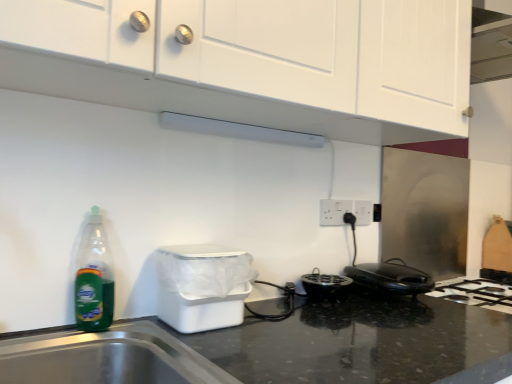
What is the approximate height of white plastic trash bin at lower left?

white plastic trash bin at lower left is 7.24 inches tall.

Where is `green translucent bottle at left`? The height and width of the screenshot is (384, 512). green translucent bottle at left is located at coordinates (94, 278).

Image resolution: width=512 pixels, height=384 pixels. In order to click on white plastic electric outlet at center right, the second electric outlet positioned from the back in this screenshot , I will do `click(334, 211)`.

Image resolution: width=512 pixels, height=384 pixels. What do you see at coordinates (238, 130) in the screenshot?
I see `white matte exhaust hood at upper center` at bounding box center [238, 130].

Image resolution: width=512 pixels, height=384 pixels. I want to click on black plastic toaster at lower right, so click(390, 278).

Identify the location of white plastic trash bin at lower left. Image resolution: width=512 pixels, height=384 pixels. (202, 286).

Can you confirm if white plastic trash bin at lower left is shorter than white plastic electric outlet at center right, the second electric outlet positioned from the back?

In fact, white plastic trash bin at lower left may be taller than white plastic electric outlet at center right, the second electric outlet positioned from the back.

Considering the relative sizes of white plastic trash bin at lower left and white plastic electric outlet at center right, which is counted as the first electric outlet, starting from the front, in the image provided, is white plastic trash bin at lower left thinner than white plastic electric outlet at center right, which is counted as the first electric outlet, starting from the front,?

No, white plastic trash bin at lower left is not thinner than white plastic electric outlet at center right, which is counted as the first electric outlet, starting from the front.

Does point (168, 300) lie behind point (330, 225)?

No, (168, 300) is in front of (330, 225).

Is the position of white plastic trash bin at lower left more distant than that of white plastic electric outlet at center right, arranged as the 1th electric outlet when viewed from the left?

That is False.

Does point (257, 129) come closer to viewer compared to point (194, 257)?

No, it is behind (194, 257).

Considering the sizes of objects white matte exhaust hood at upper center and white plastic trash bin at lower left in the image provided, who is wider, white matte exhaust hood at upper center or white plastic trash bin at lower left?

With larger width is white plastic trash bin at lower left.

Is white matte exhaust hood at upper center aimed at white plastic trash bin at lower left?

No, white matte exhaust hood at upper center is not aimed at white plastic trash bin at lower left.

The image size is (512, 384). I want to click on electric outlet beneath the white plastic electric outlet at center, which is counted as the 2th electric outlet, starting from the left (from a real-world perspective), so click(334, 211).

Between white plastic electric outlet at center, which is the first electric outlet in back-to-front order, and white plastic electric outlet at center right, which is counted as the first electric outlet, starting from the front, which one has smaller width?

Thinner between the two is white plastic electric outlet at center right, which is counted as the first electric outlet, starting from the front.

Is white plastic electric outlet at center, marked as the second electric outlet in a front-to-back arrangement, surrounding white plastic electric outlet at center right, arranged as the 1th electric outlet when viewed from the left?

Actually, white plastic electric outlet at center right, arranged as the 1th electric outlet when viewed from the left, is outside white plastic electric outlet at center, marked as the second electric outlet in a front-to-back arrangement.

Considering the sizes of black plastic toaster at lower right and white plastic electric outlet at center right, which ranks as the second electric outlet in right-to-left order, in the image, is black plastic toaster at lower right wider or thinner than white plastic electric outlet at center right, which ranks as the second electric outlet in right-to-left order,?

Considering their sizes, black plastic toaster at lower right looks broader than white plastic electric outlet at center right, which ranks as the second electric outlet in right-to-left order.

Does black plastic toaster at lower right have a lesser height compared to white plastic electric outlet at center right, which ranks as the second electric outlet in right-to-left order?

Yes.

What's the angular difference between black plastic toaster at lower right and white plastic electric outlet at center right, the second electric outlet positioned from the back,'s facing directions?

The facing directions of black plastic toaster at lower right and white plastic electric outlet at center right, the second electric outlet positioned from the back, are 0.025 degrees apart.

Identify the location of the 2nd electric outlet counting from the left of the black plastic toaster at lower right. This screenshot has height=384, width=512. (334, 211).

Which object is positioned more to the left, white plastic electric outlet at center, which is the first electric outlet in back-to-front order, or white matte cabinet at upper center?

white matte cabinet at upper center is more to the left.

I want to click on cabinetry above the white plastic electric outlet at center, which is counted as the 2th electric outlet, starting from the left (from the image's perspective), so click(255, 61).

Which is closer, (x=360, y=200) or (x=246, y=7)?

Point (x=360, y=200) is farther from the camera than point (x=246, y=7).

What's the angular difference between white plastic electric outlet at center, marked as the second electric outlet in a front-to-back arrangement, and white matte exhaust hood at upper center's facing directions?

The angle between the facing direction of white plastic electric outlet at center, marked as the second electric outlet in a front-to-back arrangement, and the facing direction of white matte exhaust hood at upper center is 0.0205 degrees.

Is white plastic electric outlet at center, which is the first electric outlet in back-to-front order, shorter than white matte exhaust hood at upper center?

In fact, white plastic electric outlet at center, which is the first electric outlet in back-to-front order, may be taller than white matte exhaust hood at upper center.

Measure the distance between white plastic electric outlet at center, the first electric outlet from the right, and white matte exhaust hood at upper center.

white plastic electric outlet at center, the first electric outlet from the right, is 19.00 inches away from white matte exhaust hood at upper center.

From a real-world perspective, is white plastic electric outlet at center, marked as the second electric outlet in a front-to-back arrangement, positioned above or below white matte exhaust hood at upper center?

white plastic electric outlet at center, marked as the second electric outlet in a front-to-back arrangement, is situated lower than white matte exhaust hood at upper center in the real world.

Which object is further away from the camera taking this photo, white matte cabinet at upper center or white plastic electric outlet at center, marked as the second electric outlet in a front-to-back arrangement?

Positioned behind is white plastic electric outlet at center, marked as the second electric outlet in a front-to-back arrangement.

Is white matte cabinet at upper center with white plastic electric outlet at center, marked as the second electric outlet in a front-to-back arrangement?

white matte cabinet at upper center and white plastic electric outlet at center, marked as the second electric outlet in a front-to-back arrangement, are not in contact.

You are a GUI agent. You are given a task and a screenshot of the screen. Output one action in this format:
    pyautogui.click(x=<x>, y=<y>)
    Task: Click on the cabinetry that appears in front of the white plastic electric outlet at center, the first electric outlet from the right
    
    Given the screenshot: What is the action you would take?
    pyautogui.click(x=255, y=61)

Locate an element on the screen. This screenshot has width=512, height=384. the 2nd electric outlet above the white plastic trash bin at lower left (from the image's perspective) is located at coordinates (334, 211).

The height and width of the screenshot is (384, 512). Identify the location of exhaust hood behind the white plastic trash bin at lower left. coord(238,130).

Looking at the image, which one is located closer to white plastic trash bin at lower left, white plastic electric outlet at center right, the second electric outlet positioned from the back, or white plastic electric outlet at center, which is the first electric outlet in back-to-front order?

Based on the image, white plastic electric outlet at center right, the second electric outlet positioned from the back, appears to be nearer to white plastic trash bin at lower left.

Considering their positions, is black plastic toaster at lower right positioned further to white plastic trash bin at lower left than white matte cabinet at upper center?

Among the two, black plastic toaster at lower right is located further to white plastic trash bin at lower left.

From the image, which object appears to be nearer to white plastic trash bin at lower left, green translucent bottle at left or white plastic electric outlet at center right, the second electric outlet positioned from the back?

green translucent bottle at left is positioned closer to the anchor white plastic trash bin at lower left.

Based on the photo, from the image, which object appears to be farther from white plastic electric outlet at center right, the second electric outlet positioned from the back, white plastic electric outlet at center, marked as the second electric outlet in a front-to-back arrangement, or white matte cabinet at upper center?

white matte cabinet at upper center.

Based on their spatial positions, is black plastic toaster at lower right or green translucent bottle at left closer to white matte exhaust hood at upper center?

green translucent bottle at left is positioned closer to the anchor white matte exhaust hood at upper center.

Based on the photo, looking at the image, which one is located further to white matte exhaust hood at upper center, white plastic trash bin at lower left or white plastic electric outlet at center right, which is counted as the first electric outlet, starting from the front?

white plastic trash bin at lower left is positioned further to the anchor white matte exhaust hood at upper center.

Considering their positions, is green translucent bottle at left positioned closer to white matte exhaust hood at upper center than white matte cabinet at upper center?

white matte cabinet at upper center is positioned closer to the anchor white matte exhaust hood at upper center.

Based on their spatial positions, is white matte exhaust hood at upper center or white matte cabinet at upper center further from white plastic electric outlet at center right, which is counted as the first electric outlet, starting from the front?

Among the two, white matte cabinet at upper center is located further to white plastic electric outlet at center right, which is counted as the first electric outlet, starting from the front.

This screenshot has width=512, height=384. I want to click on appliance between white matte cabinet at upper center and white plastic electric outlet at center right, which ranks as the second electric outlet in right-to-left order, from front to back, so click(x=202, y=286).

Locate an element on the screen. This screenshot has height=384, width=512. home appliance between white plastic trash bin at lower left and white plastic electric outlet at center, which is counted as the 2th electric outlet, starting from the left, from front to back is located at coordinates (390, 278).

Where is `exhaust hood situated between green translucent bottle at left and black plastic toaster at lower right from left to right`? exhaust hood situated between green translucent bottle at left and black plastic toaster at lower right from left to right is located at coordinates (238, 130).

Where is `appliance between white matte cabinet at upper center and black plastic toaster at lower right in the up-down direction`? Image resolution: width=512 pixels, height=384 pixels. appliance between white matte cabinet at upper center and black plastic toaster at lower right in the up-down direction is located at coordinates (202, 286).